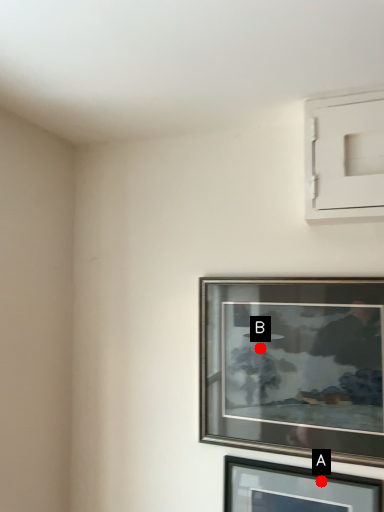
Question: Two points are circled on the image, labeled by A and B beside each circle. Which point appears farthest from the camera in this image?

Choices:
 (A) A is further
 (B) B is further

Answer: (B)